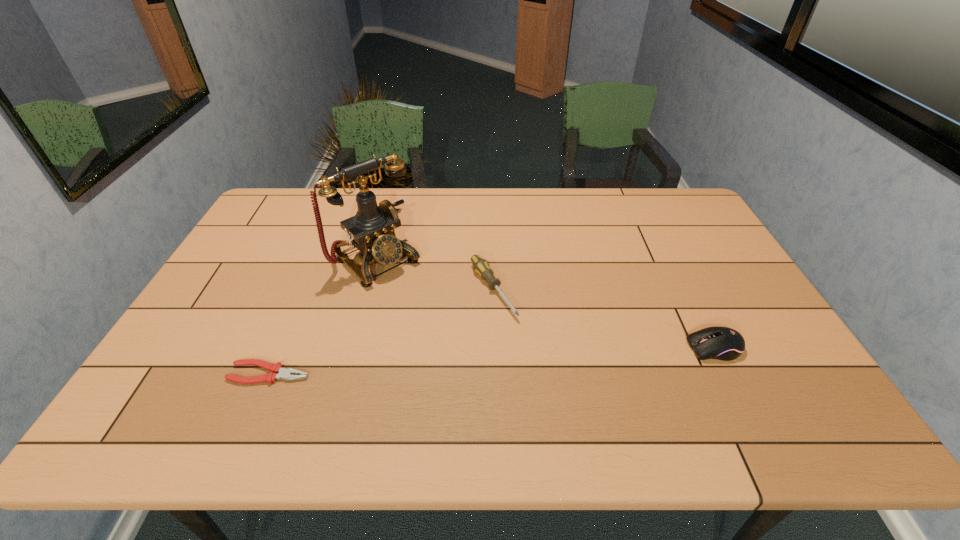
Locate an element on the screen. free space between the second shortest object and the computer mouse is located at coordinates (604, 319).

What are the coordinates of `free area in between the pliers and the third tallest object` in the screenshot? It's located at pos(381,332).

Locate an element on the screen. Image resolution: width=960 pixels, height=540 pixels. unoccupied position between the pliers and the rightmost object is located at coordinates (492, 360).

Where is `unoccupied area between the second object from right to left and the telephone`? This screenshot has width=960, height=540. unoccupied area between the second object from right to left and the telephone is located at coordinates (435, 275).

Locate an element on the screen. This screenshot has width=960, height=540. empty location between the second shortest object and the shortest object is located at coordinates (381, 332).

Identify the location of free space between the rightmost object and the third object from left to right. (604, 319).

I want to click on vacant point located between the rightmost object and the third tallest object, so click(604, 319).

Locate an element on the screen. This screenshot has width=960, height=540. free space between the pliers and the computer mouse is located at coordinates (492, 360).

Find the location of `vacant space that's between the tallest object and the shortest object`. vacant space that's between the tallest object and the shortest object is located at coordinates (324, 316).

Find the location of a particular element. object that is the third nearest to the computer mouse is located at coordinates (283, 373).